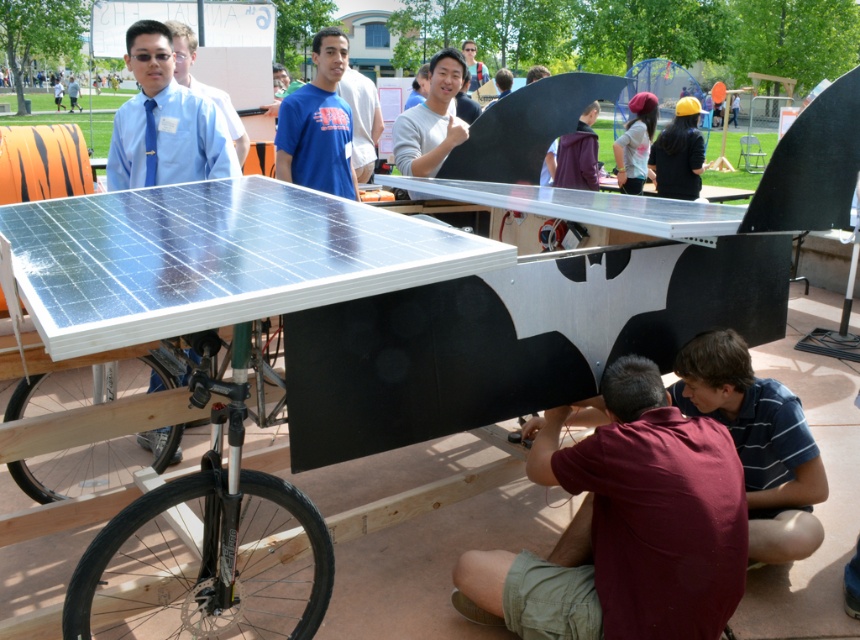
Between transparent plastic table at center and light pink fabric at center, which one appears on the left side from the viewer's perspective?

transparent plastic table at center

Who is lower down, transparent plastic table at center or light pink fabric at center?

Positioned lower is transparent plastic table at center.

Between point (114, 248) and point (652, 129), which one is positioned in front?

Positioned in front is point (114, 248).

I want to click on transparent plastic table at center, so click(x=212, y=259).

Who is taller, light pink fabric at center or matte blue shirt at upper left?

light pink fabric at center

From the picture: Who is more distant from viewer, (646, 134) or (195, 42)?

The point (646, 134) is more distant.

Identify the location of light pink fabric at center. This screenshot has height=640, width=860. (636, 141).

What do you see at coordinates (318, 124) in the screenshot?
I see `blue cotton shirt at center` at bounding box center [318, 124].

Between point (312, 188) and point (237, 150), which one is positioned behind?

Positioned behind is point (237, 150).

The image size is (860, 640). What do you see at coordinates (318, 124) in the screenshot?
I see `blue cotton shirt at center` at bounding box center [318, 124].

Where is `blue cotton shirt at center`? This screenshot has width=860, height=640. blue cotton shirt at center is located at coordinates (318, 124).